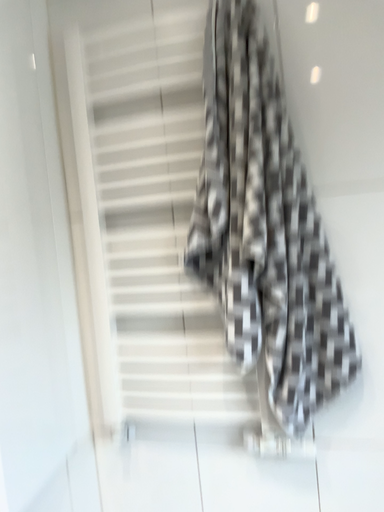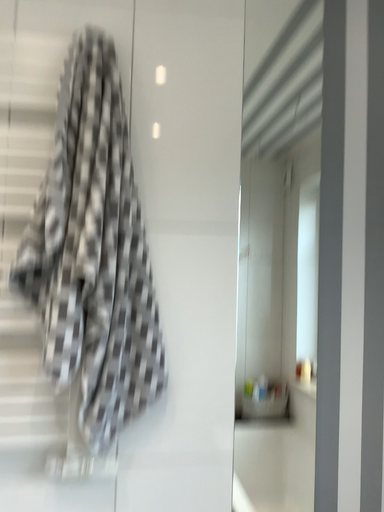
Question: Which way did the camera rotate in the video?

Choices:
 (A) rotated right
 (B) rotated left

Answer: (A)